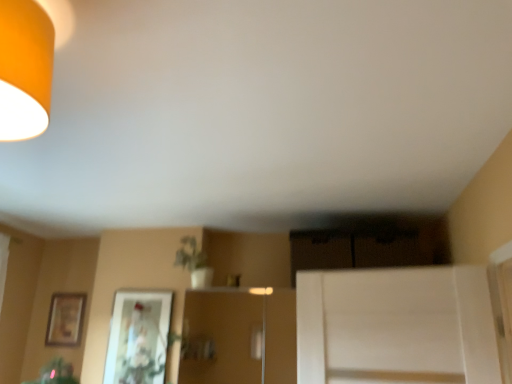
Identify the location of matte glass picture frame at center, acting as the 1th picture frame starting from the right. (138, 337).

Locate an element on the screen. green matte plant at center is located at coordinates (190, 255).

From the picture: Measure the distance between wooden framed picture at left, the second picture frame when ordered from right to left, and camera.

wooden framed picture at left, the second picture frame when ordered from right to left, and camera are 3.22 meters apart from each other.

How much space does wooden framed picture at left, placed as the first picture frame when sorted from back to front, occupy horizontally?

wooden framed picture at left, placed as the first picture frame when sorted from back to front, is 0.60 inches wide.

Where is `matte orange lampshade at upper left`? matte orange lampshade at upper left is located at coordinates (24, 69).

Locate an element on the screen. This screenshot has width=512, height=384. matte glass picture frame at center, acting as the 1th picture frame starting from the right is located at coordinates (138, 337).

Relative to matte orange lampshade at upper left, is matte glass picture frame at center, acting as the 1th picture frame starting from the right, in front or behind?

Visually, matte glass picture frame at center, acting as the 1th picture frame starting from the right, is located behind matte orange lampshade at upper left.

What's the angular difference between matte glass picture frame at center, positioned as the second picture frame in back-to-front order, and matte orange lampshade at upper left's facing directions?

They differ by 89.2 degrees in their facing directions.

Find the location of a particular element. The image size is (512, 384). picture frame that is the 2nd object directly below the matte orange lampshade at upper left (from a real-world perspective) is located at coordinates (138, 337).

From the image's perspective, is matte glass picture frame at center, acting as the 1th picture frame starting from the right, under matte orange lampshade at upper left?

Yes.

Between wooden framed picture at left, which ranks as the 1th picture frame in left-to-right order, and matte glass picture frame at center, acting as the 1th picture frame starting from the right, which one has more height?

With more height is matte glass picture frame at center, acting as the 1th picture frame starting from the right.

Can you see wooden framed picture at left, the second picture frame when ordered from right to left, touching matte glass picture frame at center, the 1th picture frame positioned from the front?

wooden framed picture at left, the second picture frame when ordered from right to left, and matte glass picture frame at center, the 1th picture frame positioned from the front, are clearly separated.

Considering the relative sizes of wooden framed picture at left, placed as the first picture frame when sorted from back to front, and matte glass picture frame at center, the 1th picture frame positioned from the front, in the image provided, is wooden framed picture at left, placed as the first picture frame when sorted from back to front, wider than matte glass picture frame at center, the 1th picture frame positioned from the front,?

Incorrect, the width of wooden framed picture at left, placed as the first picture frame when sorted from back to front, does not surpass that of matte glass picture frame at center, the 1th picture frame positioned from the front.

Is wooden framed picture at left, placed as the first picture frame when sorted from back to front, positioned with its back to matte glass picture frame at center, which is the 2th picture frame in left-to-right order?

That's not correct — wooden framed picture at left, placed as the first picture frame when sorted from back to front, is not looking away from matte glass picture frame at center, which is the 2th picture frame in left-to-right order.

From the image's perspective, is green matte plant at center beneath matte orange lampshade at upper left?

Indeed, from the image's perspective, green matte plant at center is shown beneath matte orange lampshade at upper left.

Does green matte plant at center touch matte orange lampshade at upper left?

No.

Where is `plant that is below the matte orange lampshade at upper left (from the image's perspective)`? Image resolution: width=512 pixels, height=384 pixels. plant that is below the matte orange lampshade at upper left (from the image's perspective) is located at coordinates (190, 255).

Between point (178, 262) and point (44, 84), which one is positioned behind?

The point (178, 262) is behind.

Considering the positions of objects wooden framed picture at left, placed as the first picture frame when sorted from back to front, and green matte plant at center in the image provided, who is in front, wooden framed picture at left, placed as the first picture frame when sorted from back to front, or green matte plant at center?

Positioned in front is green matte plant at center.

From the image's perspective, does wooden framed picture at left, which ranks as the 1th picture frame in left-to-right order, appear lower than green matte plant at center?

Yes, from the image's perspective, wooden framed picture at left, which ranks as the 1th picture frame in left-to-right order, is below green matte plant at center.

Would you say wooden framed picture at left, marked as the 2th picture frame in a front-to-back arrangement, is to the left or to the right of green matte plant at center in the picture?

Based on their positions, wooden framed picture at left, marked as the 2th picture frame in a front-to-back arrangement, is located to the left of green matte plant at center.

How much distance is there between matte orange lampshade at upper left and matte glass picture frame at center, the 1th picture frame positioned from the front?

They are 6.75 feet apart.

From a real-world perspective, is matte orange lampshade at upper left over matte glass picture frame at center, positioned as the second picture frame in back-to-front order?

Yes, from a real-world perspective, matte orange lampshade at upper left is above matte glass picture frame at center, positioned as the second picture frame in back-to-front order.

Which object is further away from the camera, matte orange lampshade at upper left or matte glass picture frame at center, acting as the 1th picture frame starting from the right?

Positioned behind is matte glass picture frame at center, acting as the 1th picture frame starting from the right.

Looking at this image, would you say matte orange lampshade at upper left is a long distance from matte glass picture frame at center, the 1th picture frame positioned from the front?

That's right, there is a large distance between matte orange lampshade at upper left and matte glass picture frame at center, the 1th picture frame positioned from the front.

Between green matte plant at center and matte glass picture frame at center, positioned as the second picture frame in back-to-front order, which one is positioned in front?

green matte plant at center is more forward.

Is point (188, 258) positioned behind point (110, 353)?

That is False.

Is green matte plant at center bigger than matte glass picture frame at center, the 1th picture frame positioned from the front?

Yes, green matte plant at center is bigger than matte glass picture frame at center, the 1th picture frame positioned from the front.

Which object is positioned more to the left, green matte plant at center or matte glass picture frame at center, positioned as the second picture frame in back-to-front order?

Positioned to the left is matte glass picture frame at center, positioned as the second picture frame in back-to-front order.

Considering the relative positions of matte glass picture frame at center, the 1th picture frame positioned from the front, and wooden framed picture at left, the second picture frame when ordered from right to left, in the image provided, is matte glass picture frame at center, the 1th picture frame positioned from the front, to the left of wooden framed picture at left, the second picture frame when ordered from right to left, from the viewer's perspective?

No.

Consider the image. Which is correct: matte glass picture frame at center, acting as the 1th picture frame starting from the right, is inside wooden framed picture at left, the second picture frame when ordered from right to left, or outside of it?

matte glass picture frame at center, acting as the 1th picture frame starting from the right, is not enclosed by wooden framed picture at left, the second picture frame when ordered from right to left.

Where is `picture frame on the right of wooden framed picture at left, marked as the 2th picture frame in a front-to-back arrangement`? picture frame on the right of wooden framed picture at left, marked as the 2th picture frame in a front-to-back arrangement is located at coordinates (138, 337).

Are matte glass picture frame at center, positioned as the second picture frame in back-to-front order, and wooden framed picture at left, the second picture frame when ordered from right to left, beside each other?

No.

Starting from the matte orange lampshade at upper left, which picture frame is the 1st one to the left? Please provide its 2D coordinates.

[(138, 337)]

Locate an element on the screen. The image size is (512, 384). picture frame that is under the wooden framed picture at left, which ranks as the 1th picture frame in left-to-right order (from a real-world perspective) is located at coordinates click(x=138, y=337).

When comparing their distances from matte orange lampshade at upper left, does green matte plant at center or wooden framed picture at left, the second picture frame when ordered from right to left, seem closer?

green matte plant at center is positioned closer to the anchor matte orange lampshade at upper left.

Based on their spatial positions, is green matte plant at center or matte orange lampshade at upper left closer to matte glass picture frame at center, which is the 2th picture frame in left-to-right order?

Among the two, green matte plant at center is located nearer to matte glass picture frame at center, which is the 2th picture frame in left-to-right order.

Which object lies further to the anchor point green matte plant at center, wooden framed picture at left, placed as the first picture frame when sorted from back to front, or matte glass picture frame at center, the 1th picture frame positioned from the front?

wooden framed picture at left, placed as the first picture frame when sorted from back to front.

Considering their positions, is green matte plant at center positioned closer to wooden framed picture at left, which ranks as the 1th picture frame in left-to-right order, than matte glass picture frame at center, acting as the 1th picture frame starting from the right?

Based on the image, matte glass picture frame at center, acting as the 1th picture frame starting from the right, appears to be nearer to wooden framed picture at left, which ranks as the 1th picture frame in left-to-right order.

Looking at the image, which one is located further to wooden framed picture at left, which ranks as the 1th picture frame in left-to-right order, matte glass picture frame at center, positioned as the second picture frame in back-to-front order, or green matte plant at center?

green matte plant at center lies further to wooden framed picture at left, which ranks as the 1th picture frame in left-to-right order, than the other object.

Considering their positions, is matte glass picture frame at center, acting as the 1th picture frame starting from the right, positioned closer to matte orange lampshade at upper left than wooden framed picture at left, which ranks as the 1th picture frame in left-to-right order?

matte glass picture frame at center, acting as the 1th picture frame starting from the right, lies closer to matte orange lampshade at upper left than the other object.

From the image, which object appears to be farther from matte glass picture frame at center, the 1th picture frame positioned from the front, green matte plant at center or wooden framed picture at left, which ranks as the 1th picture frame in left-to-right order?

The object further to matte glass picture frame at center, the 1th picture frame positioned from the front, is wooden framed picture at left, which ranks as the 1th picture frame in left-to-right order.

Estimate the real-world distances between objects in this image. Which object is closer to green matte plant at center, matte glass picture frame at center, positioned as the second picture frame in back-to-front order, or wooden framed picture at left, which ranks as the 1th picture frame in left-to-right order?

Among the two, matte glass picture frame at center, positioned as the second picture frame in back-to-front order, is located nearer to green matte plant at center.

Where is `plant between matte orange lampshade at upper left and wooden framed picture at left, the second picture frame when ordered from right to left, along the z-axis`? Image resolution: width=512 pixels, height=384 pixels. plant between matte orange lampshade at upper left and wooden framed picture at left, the second picture frame when ordered from right to left, along the z-axis is located at coordinates (190, 255).

I want to click on picture frame between matte orange lampshade at upper left and wooden framed picture at left, placed as the first picture frame when sorted from back to front, from front to back, so click(x=138, y=337).

This screenshot has width=512, height=384. I want to click on picture frame between wooden framed picture at left, the second picture frame when ordered from right to left, and green matte plant at center, in the horizontal direction, so click(138, 337).

At what (x,y) coordinates should I click in order to perform the action: click on plant between matte orange lampshade at upper left and matte glass picture frame at center, positioned as the second picture frame in back-to-front order, along the z-axis. Please return your answer as a coordinate pair (x, y). Looking at the image, I should click on (190, 255).